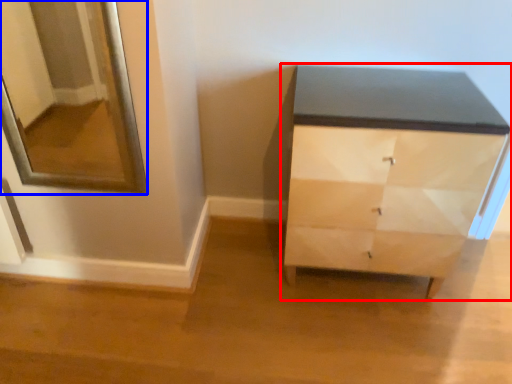
Question: Which point is closer to the camera, chest of drawers (highlighted by a red box) or mirror (highlighted by a blue box)?

Choices:
 (A) chest of drawers
 (B) mirror

Answer: (B)